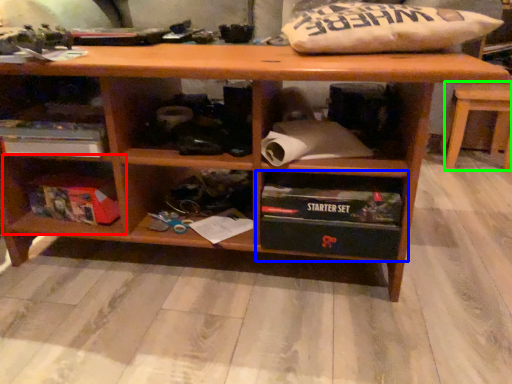
Question: Based on their relative distances, which object is farther from shelf (highlighted by a red box)? Choose from shelf (highlighted by a blue box) and table (highlighted by a green box).

Choices:
 (A) shelf
 (B) table

Answer: (B)